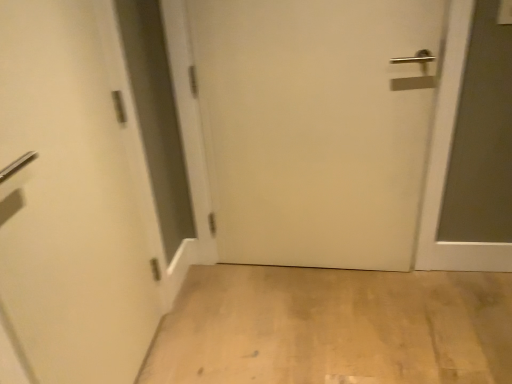
Question: Is the position of white matte door at left, which appears as the 1th door when viewed from the left, more distant than that of light wood floor at lower center?

Choices:
 (A) yes
 (B) no

Answer: (B)

Question: From a real-world perspective, is white matte door at left, placed as the second door when sorted from right to left, positioned over light wood floor at lower center based on gravity?

Choices:
 (A) no
 (B) yes

Answer: (B)

Question: Can you confirm if white matte door at left, which appears as the 1th door when viewed from the left, is taller than light wood floor at lower center?

Choices:
 (A) no
 (B) yes

Answer: (B)

Question: Considering the relative sizes of white matte door at left, placed as the second door when sorted from right to left, and light wood floor at lower center in the image provided, is white matte door at left, placed as the second door when sorted from right to left, wider than light wood floor at lower center?

Choices:
 (A) yes
 (B) no

Answer: (B)

Question: Is white matte door at center, positioned as the first door in right-to-left order, spatially inside white matte door at left, placed as the second door when sorted from right to left, or outside of it?

Choices:
 (A) inside
 (B) outside

Answer: (B)

Question: From a real-world perspective, is white matte door at center, positioned as the first door in right-to-left order, positioned above or below white matte door at left, placed as the second door when sorted from right to left?

Choices:
 (A) below
 (B) above

Answer: (A)

Question: In terms of height, does white matte door at center, positioned as the first door in right-to-left order, look taller or shorter compared to white matte door at left, which appears as the 1th door when viewed from the left?

Choices:
 (A) short
 (B) tall

Answer: (A)

Question: Is white matte door at center, which appears as the second door when viewed from the left, in front of or behind white matte door at left, which appears as the 1th door when viewed from the left, in the image?

Choices:
 (A) front
 (B) behind

Answer: (B)

Question: In terms of width, does light wood floor at lower center look wider or thinner when compared to white matte door at center, positioned as the first door in right-to-left order?

Choices:
 (A) thin
 (B) wide

Answer: (B)

Question: From a real-world perspective, is light wood floor at lower center above or below white matte door at center, positioned as the first door in right-to-left order?

Choices:
 (A) below
 (B) above

Answer: (A)

Question: From the image's perspective, is light wood floor at lower center located above or below white matte door at center, positioned as the first door in right-to-left order?

Choices:
 (A) below
 (B) above

Answer: (A)

Question: Is point (462, 336) closer or farther from the camera than point (300, 8)?

Choices:
 (A) closer
 (B) farther

Answer: (B)

Question: Would you say white matte door at left, which appears as the 1th door when viewed from the left, is inside or outside white matte door at center, which appears as the second door when viewed from the left?

Choices:
 (A) outside
 (B) inside

Answer: (A)

Question: In the image, is white matte door at left, which appears as the 1th door when viewed from the left, on the left side or the right side of white matte door at center, positioned as the first door in right-to-left order?

Choices:
 (A) right
 (B) left

Answer: (B)